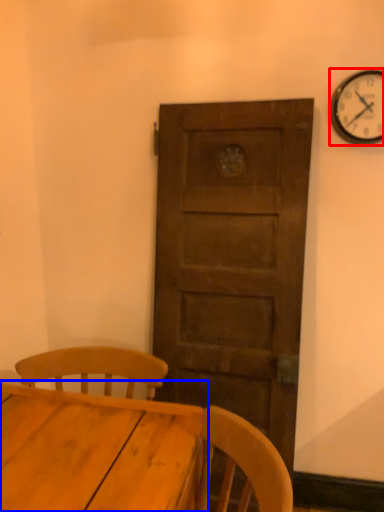
Question: Among these objects, which one is farthest to the camera, wall clock (highlighted by a red box) or table (highlighted by a blue box)?

Choices:
 (A) wall clock
 (B) table

Answer: (A)